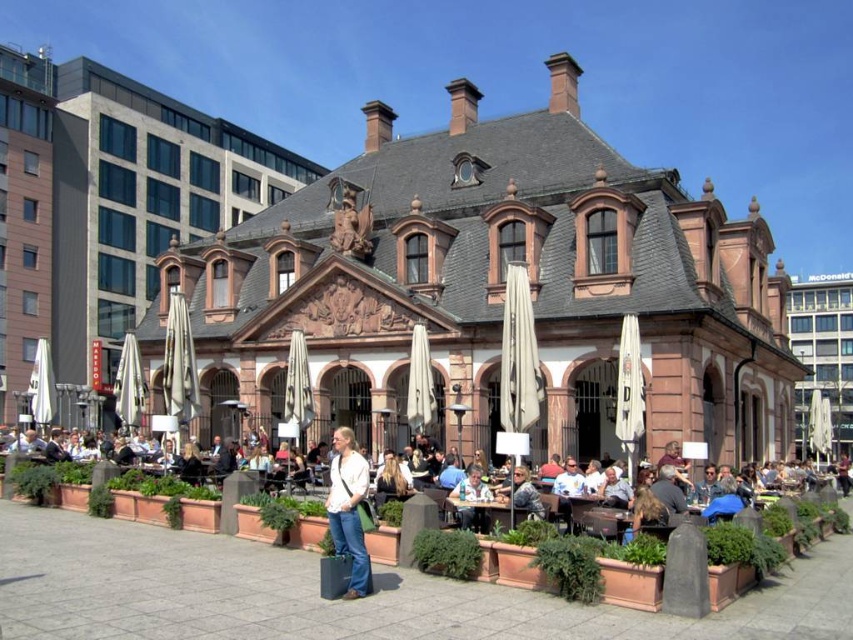
Question: Among these objects, which one is farthest from the camera?

Choices:
 (A) wooden table at center
 (B) white shirt at center

Answer: (B)

Question: Based on their relative distances, which object is nearer to the denim jacket at lower center?

Choices:
 (A) light brown wooden chair at lower center
 (B) white shirt at center
 (C) denim jeans at center
 (D) wooden table at center

Answer: (D)

Question: Can you confirm if denim jeans at center is wider than light brown wooden chair at lower center?

Choices:
 (A) no
 (B) yes

Answer: (B)

Question: Can you confirm if white shirt at center is positioned to the right of denim jacket at lower center?

Choices:
 (A) no
 (B) yes

Answer: (A)

Question: Based on their relative distances, which object is nearer to the light brown wooden chair at lower center?

Choices:
 (A) denim jeans at center
 (B) wooden table at center

Answer: (B)

Question: Can you confirm if white shirt at center is thinner than light brown wooden chair at lower center?

Choices:
 (A) yes
 (B) no

Answer: (B)